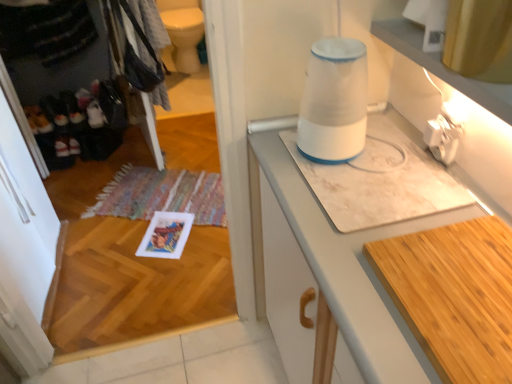
Question: Should I look upward or downward to see white plastic blender at upper center?

Choices:
 (A) up
 (B) down

Answer: (A)

Question: Is multicolored woven mat at lower left outside of white marble countertop at center?

Choices:
 (A) no
 (B) yes

Answer: (B)

Question: From a real-world perspective, is multicolored woven mat at lower left physically below white marble countertop at center?

Choices:
 (A) no
 (B) yes

Answer: (B)

Question: Considering the relative sizes of multicolored woven mat at lower left and white marble countertop at center in the image provided, is multicolored woven mat at lower left bigger than white marble countertop at center?

Choices:
 (A) no
 (B) yes

Answer: (A)

Question: Is multicolored woven mat at lower left at the right side of white marble countertop at center?

Choices:
 (A) yes
 (B) no

Answer: (B)

Question: Is multicolored woven mat at lower left thinner than white marble countertop at center?

Choices:
 (A) no
 (B) yes

Answer: (A)

Question: Is white marble countertop at center at the back of multicolored woven mat at lower left?

Choices:
 (A) no
 (B) yes

Answer: (A)

Question: From a real-world perspective, is white marble countertop at center physically above multicolored woven mat at lower left?

Choices:
 (A) no
 (B) yes

Answer: (B)

Question: Can you confirm if white marble countertop at center is wider than multicolored woven mat at lower left?

Choices:
 (A) yes
 (B) no

Answer: (B)

Question: Is white marble countertop at center turned away from multicolored woven mat at lower left?

Choices:
 (A) yes
 (B) no

Answer: (B)

Question: Is white marble countertop at center directly adjacent to multicolored woven mat at lower left?

Choices:
 (A) no
 (B) yes

Answer: (A)

Question: Is white marble countertop at center positioned in front of multicolored woven mat at lower left?

Choices:
 (A) no
 (B) yes

Answer: (B)

Question: From a real-world perspective, is white marble countertop at center below multicolored woven mat at lower left?

Choices:
 (A) yes
 (B) no

Answer: (B)

Question: Is wooden cutting board at lower right at the left side of white marble countertop at center?

Choices:
 (A) no
 (B) yes

Answer: (A)